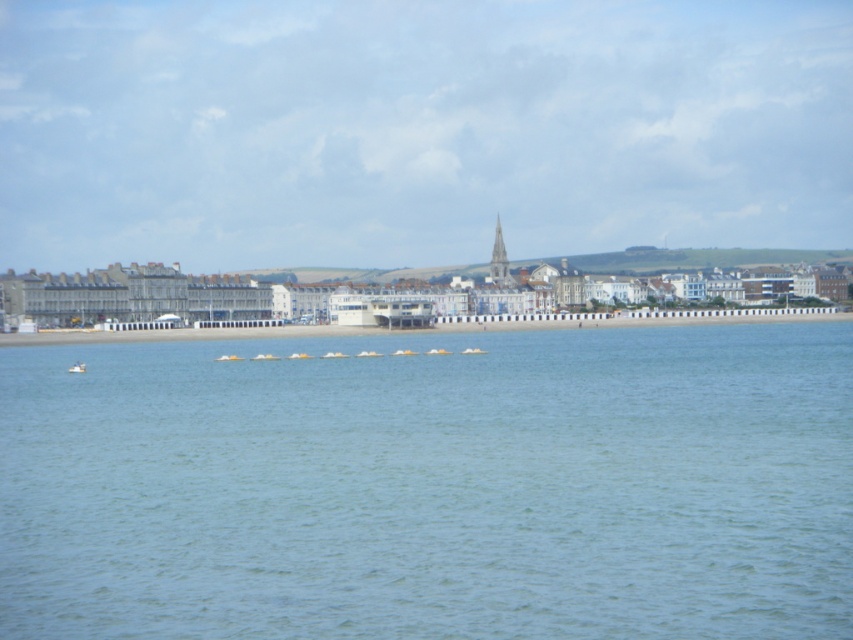
You are standing on the beach and want to place the white plastic boat at lower left on top of the white sand at center. Is this possible based on their sizes?

The white sand at center is taller than the white plastic boat at lower left, so placing the boat on top would not be possible since the sand is higher in elevation.

You are a photographer planning to capture the white plastic boat at lower left and the clear blue water at center in one frame. Based on their sizes, which object will appear bigger in the photo?

The clear blue water at center will appear bigger in the photo because it has a larger size compared to the white plastic boat at lower left.